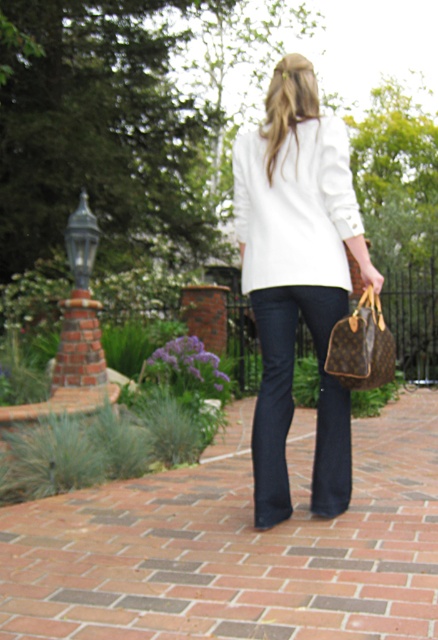
You are a photographer trying to capture the person in the image. You want to ensure that both the white smooth sweater at center and the dark blue denim jeans at center are in focus. The camera you are using has a depth of field that can cover 60 centimeters. Do you think both items will be in focus?

The white smooth sweater at center is 57.95 centimeters away from the dark blue denim jeans at center. Since the distance between them is less than the camera depth of field of 60 centimeters, both items will be in focus.

You are standing at the point marked by the coordinates point (236, 545). What object are you standing on?

The point (236, 545) indicates brick at center, so you are standing on a brick.